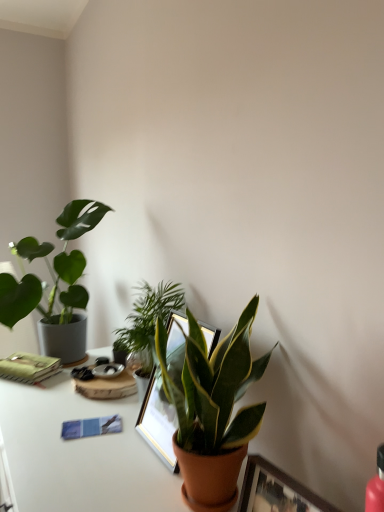
What is the approximate width of green matte plant at left, the 3th houseplant from the front?

The width of green matte plant at left, the 3th houseplant from the front, is 15.67 inches.

This screenshot has width=384, height=512. What do you see at coordinates (55, 271) in the screenshot?
I see `green matte plant at left, positioned as the third houseplant in right-to-left order` at bounding box center [55, 271].

This screenshot has width=384, height=512. Describe the element at coordinates (91, 426) in the screenshot. I see `blue paper journal at lower left` at that location.

Identify the location of white glossy table at lower center. (79, 454).

How much space does green glossy plant at center, the 2th houseplant when ordered from back to front, occupy vertically?

It is 16.04 inches.

Measure the distance between point (52, 358) and camera.

They are 5.12 feet apart.

Measure the distance between green matte notebook at left and camera.

A distance of 4.64 feet exists between green matte notebook at left and camera.

Image resolution: width=384 pixels, height=512 pixels. Find the location of `green matte plant at left, placed as the 1th houseplant when sorted from left to right`. green matte plant at left, placed as the 1th houseplant when sorted from left to right is located at coordinates (x=55, y=271).

Does point (43, 362) come behind point (138, 305)?

Yes, it is.

From the picture: In terms of height, does green matte notebook at left look taller or shorter compared to green glossy plant at center, the 2th houseplant from the front?

green matte notebook at left is shorter than green glossy plant at center, the 2th houseplant from the front.

What's the angular difference between green matte notebook at left and green glossy plant at center, the 2th houseplant from the front,'s facing directions?

There is a 31.4-degree angle between the facing directions of green matte notebook at left and green glossy plant at center, the 2th houseplant from the front.

Which object is more forward, green glossy plant at center, the 2th houseplant when ordered from back to front, or blue paper journal at lower left?

Positioned in front is blue paper journal at lower left.

Is green glossy plant at center, marked as the second houseplant in a left-to-right arrangement, not within blue paper journal at lower left?

Indeed, green glossy plant at center, marked as the second houseplant in a left-to-right arrangement, is completely outside blue paper journal at lower left.

This screenshot has width=384, height=512. Find the location of `journal on the left of the green glossy plant at center, the 2th houseplant when ordered from back to front`. journal on the left of the green glossy plant at center, the 2th houseplant when ordered from back to front is located at coordinates (91, 426).

Which is in front, point (138, 342) or point (78, 422)?

Positioned in front is point (78, 422).

Based on the photo, which is more distant, (x=63, y=438) or (x=53, y=371)?

The point (x=53, y=371) is farther.

Who is shorter, blue paper journal at lower left or green matte notebook at left?

With less height is blue paper journal at lower left.

Is blue paper journal at lower left oriented away from green matte notebook at left?

No, green matte notebook at left is not at the back of blue paper journal at lower left.

Is blue paper journal at lower left inside the boundaries of green matte notebook at left, or outside?

blue paper journal at lower left is located beyond the bounds of green matte notebook at left.

Which of these two, green matte plant at left, the 3th houseplant from the front, or green matte notebook at left, is thinner?

green matte notebook at left.

Measure the distance from green matte plant at left, the 3th houseplant from the front, to green matte notebook at left.

A distance of 10.83 inches exists between green matte plant at left, the 3th houseplant from the front, and green matte notebook at left.

Considering the relative sizes of green matte plant at left, positioned as the third houseplant in right-to-left order, and green matte notebook at left in the image provided, is green matte plant at left, positioned as the third houseplant in right-to-left order, shorter than green matte notebook at left?

In fact, green matte plant at left, positioned as the third houseplant in right-to-left order, may be taller than green matte notebook at left.

Considering the relative positions of green matte plant at left, placed as the 1th houseplant when sorted from left to right, and green matte notebook at left in the image provided, is green matte plant at left, placed as the 1th houseplant when sorted from left to right, to the right of green matte notebook at left from the viewer's perspective?

Yes.

Considering the sizes of objects wooden picture frame at center and green matte notebook at left in the image provided, who is bigger, wooden picture frame at center or green matte notebook at left?

wooden picture frame at center.

Considering the sizes of objects wooden picture frame at center and green matte notebook at left in the image provided, who is thinner, wooden picture frame at center or green matte notebook at left?

wooden picture frame at center.

Where is `paperback book behind the wooden picture frame at center`? The width and height of the screenshot is (384, 512). paperback book behind the wooden picture frame at center is located at coordinates (29, 368).

Based on the photo, considering the relative positions of green matte notebook at left and blue paper journal at lower left in the image provided, is green matte notebook at left to the right of blue paper journal at lower left from the viewer's perspective?

No, green matte notebook at left is not to the right of blue paper journal at lower left.

Considering the sizes of objects green matte notebook at left and blue paper journal at lower left in the image provided, who is shorter, green matte notebook at left or blue paper journal at lower left?

blue paper journal at lower left is shorter.

Measure the distance from green matte notebook at left to blue paper journal at lower left.

A distance of 15.61 inches exists between green matte notebook at left and blue paper journal at lower left.

From the image's perspective, is green matte notebook at left located beneath blue paper journal at lower left?

No.

Considering the sizes of blue paper journal at lower left and white glossy table at lower center in the image, is blue paper journal at lower left taller or shorter than white glossy table at lower center?

Clearly, blue paper journal at lower left is shorter compared to white glossy table at lower center.

Which object is closer to the camera, blue paper journal at lower left or white glossy table at lower center?

white glossy table at lower center is more forward.

From a real-world perspective, relative to white glossy table at lower center, is blue paper journal at lower left vertically above or below?

From a real-world perspective, blue paper journal at lower left is physically above white glossy table at lower center.

Consider the image. Would you say blue paper journal at lower left is inside or outside white glossy table at lower center?

blue paper journal at lower left lies within the bounds of white glossy table at lower center.

Where is `houseplant that is the 2nd object to the right of the green matte notebook at left, starting at the anchor`? Image resolution: width=384 pixels, height=512 pixels. houseplant that is the 2nd object to the right of the green matte notebook at left, starting at the anchor is located at coordinates (148, 320).

The image size is (384, 512). In the image, there is a green glossy plant at center, marked as the second houseplant in a left-to-right arrangement. In order to click on journal below it (from the image's perspective) in this screenshot , I will do `click(91, 426)`.

Based on their spatial positions, is green matte plant at center, marked as the third houseplant in a left-to-right arrangement, or white glossy table at lower center closer to wooden picture frame at center?

green matte plant at center, marked as the third houseplant in a left-to-right arrangement, is closer to wooden picture frame at center.

When comparing their distances from green matte plant at center, the 1th houseplant positioned from the front, does white glossy table at lower center or green glossy plant at center, the 2th houseplant when ordered from back to front, seem closer?

The object closer to green matte plant at center, the 1th houseplant positioned from the front, is white glossy table at lower center.

Considering their positions, is white glossy table at lower center positioned closer to green matte plant at left, placed as the 1th houseplant when sorted from left to right, than blue paper journal at lower left?

Based on the image, white glossy table at lower center appears to be nearer to green matte plant at left, placed as the 1th houseplant when sorted from left to right.

Estimate the real-world distances between objects in this image. Which object is closer to green glossy plant at center, marked as the second houseplant in a left-to-right arrangement, white glossy table at lower center or wooden picture frame at center?

Among the two, white glossy table at lower center is located nearer to green glossy plant at center, marked as the second houseplant in a left-to-right arrangement.

Looking at the image, which one is located closer to green matte notebook at left, green matte plant at center, the 1th houseplant positioned from the front, or white glossy table at lower center?

white glossy table at lower center is closer to green matte notebook at left.

Based on their spatial positions, is blue paper journal at lower left or green matte plant at left, placed as the 1th houseplant when sorted from left to right, closer to green glossy plant at center, the 2th houseplant from the front?

Based on the image, blue paper journal at lower left appears to be nearer to green glossy plant at center, the 2th houseplant from the front.

In the scene shown: Which object lies further to the anchor point wooden picture frame at center, green glossy plant at center, acting as the second houseplant starting from the right, or green matte notebook at left?

green matte notebook at left is positioned further to the anchor wooden picture frame at center.

Looking at the image, which one is located closer to green matte notebook at left, blue paper journal at lower left or green glossy plant at center, acting as the second houseplant starting from the right?

Based on the image, green glossy plant at center, acting as the second houseplant starting from the right, appears to be nearer to green matte notebook at left.

Identify the location of houseplant situated between green matte plant at left, placed as the 1th houseplant when sorted from left to right, and green matte plant at center, placed as the 1th houseplant when sorted from right to left, from left to right. (148, 320).

In order to click on journal positioned between white glossy table at lower center and green matte notebook at left from near to far in this screenshot , I will do `click(91, 426)`.

I want to click on houseplant situated between green matte notebook at left and green glossy plant at center, the 2th houseplant from the front, from left to right, so click(x=55, y=271).

Locate an element on the screen. The width and height of the screenshot is (384, 512). houseplant between wooden picture frame at center and green glossy plant at center, marked as the second houseplant in a left-to-right arrangement, from front to back is located at coordinates (x=213, y=408).